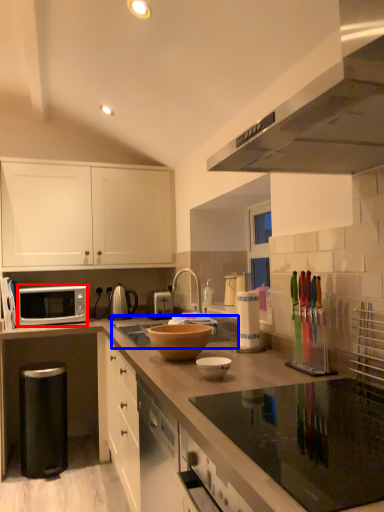
Question: Which of the following is the farthest to the observer, microwave oven (highlighted by a red box) or sink (highlighted by a blue box)?

Choices:
 (A) microwave oven
 (B) sink

Answer: (A)